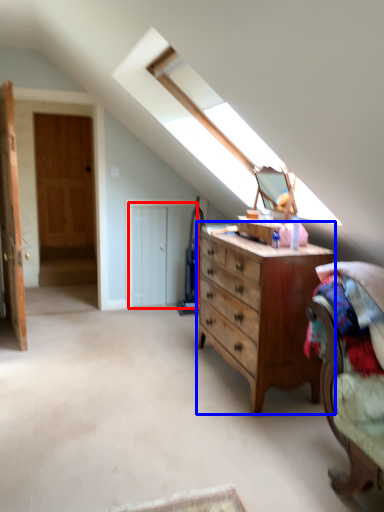
Question: Which of the following is the farthest to the observer, door (highlighted by a red box) or chest of drawers (highlighted by a blue box)?

Choices:
 (A) door
 (B) chest of drawers

Answer: (A)